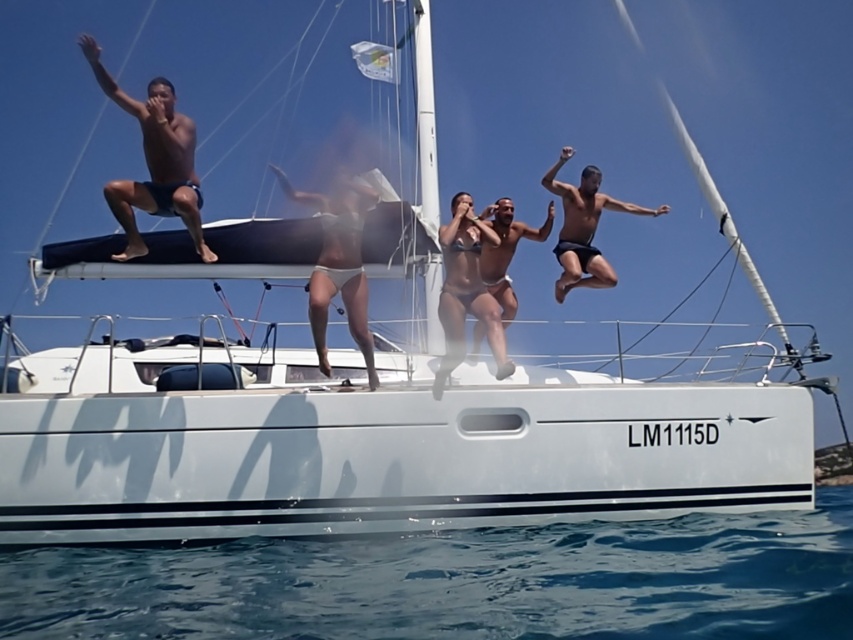
Which is behind, point (285, 612) or point (581, 241)?

Point (581, 241)

Measure the distance between point (154, 600) and camera.

Point (154, 600) is 7.47 meters away from camera.

Where is `transparent blue water at lower center`? The image size is (853, 640). transparent blue water at lower center is located at coordinates (457, 582).

Can you confirm if transparent blue water at lower center is bigger than smooth tan skin at center?

Yes, transparent blue water at lower center is bigger than smooth tan skin at center.

Is transparent blue water at lower center further to camera compared to smooth tan skin at center?

No, transparent blue water at lower center is closer to the viewer.

Does point (369, 570) come closer to viewer compared to point (508, 278)?

Yes, point (369, 570) is in front of point (508, 278).

In order to click on transparent blue water at lower center in this screenshot , I will do `click(457, 582)`.

Can you confirm if dark blue swim trunks at upper left is positioned to the left of white bikini at center?

Indeed, dark blue swim trunks at upper left is positioned on the left side of white bikini at center.

The image size is (853, 640). Describe the element at coordinates (154, 161) in the screenshot. I see `dark blue swim trunks at upper left` at that location.

You are a GUI agent. You are given a task and a screenshot of the screen. Output one action in this format:
    pyautogui.click(x=<x>, y=<y>)
    Task: Click on the dark blue swim trunks at upper left
    This screenshot has height=640, width=853.
    Given the screenshot: What is the action you would take?
    pyautogui.click(x=154, y=161)

Locate an element on the screen. The height and width of the screenshot is (640, 853). dark blue swim trunks at upper left is located at coordinates (154, 161).